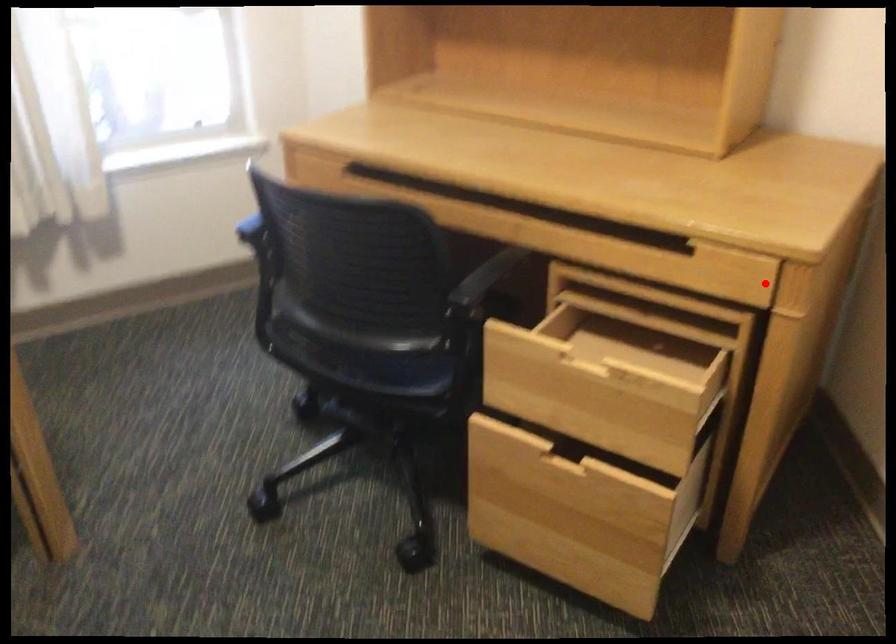
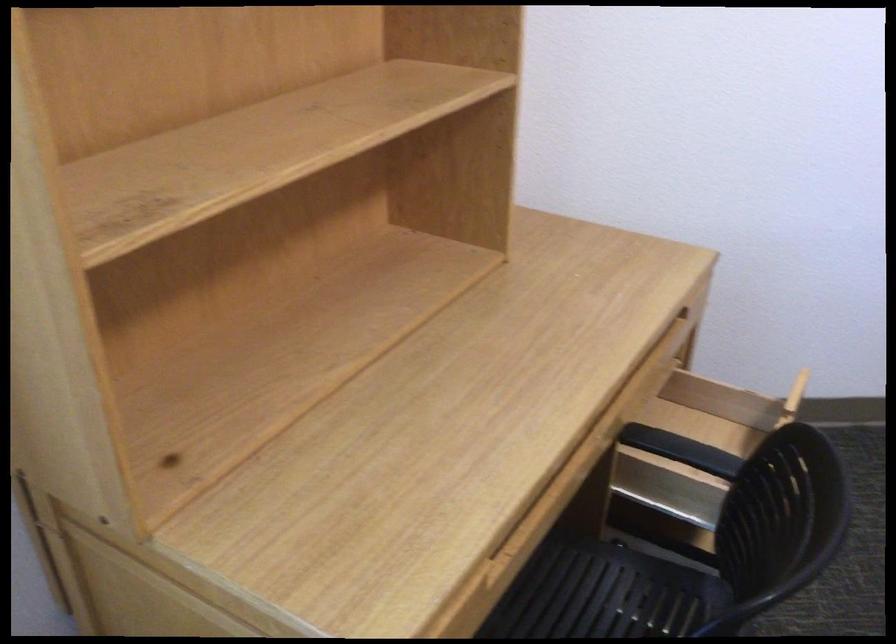
The point at the highlighted location is marked in the first image. Where is the corresponding point in the second image?

(691, 313)